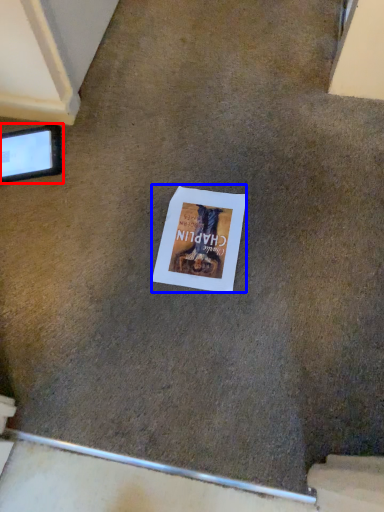
Question: Which object appears closest to the camera in this image, tablet computer (highlighted by a red box) or flyer (highlighted by a blue box)?

Choices:
 (A) tablet computer
 (B) flyer

Answer: (B)